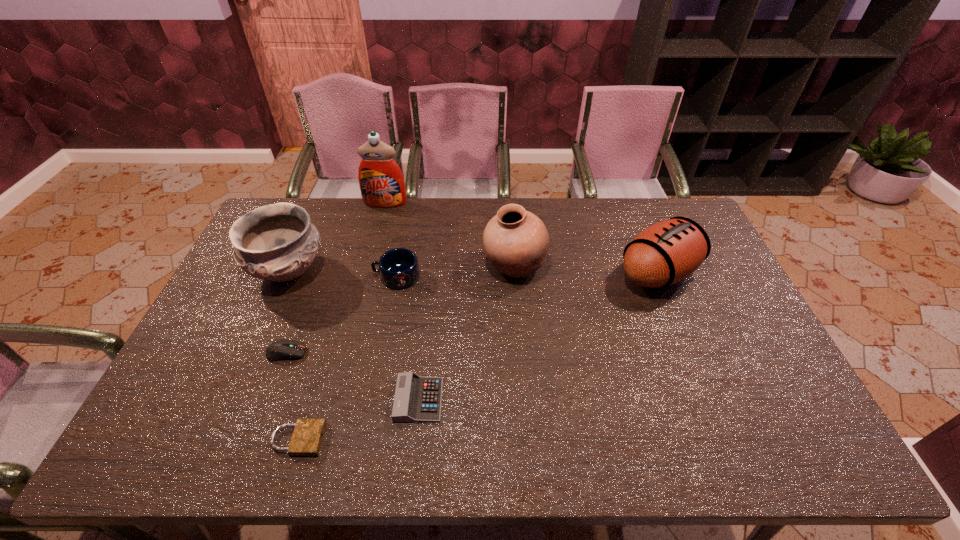
Find the location of a particular element. The image size is (960, 540). vacant space that satisfies the following two spatial constraints: 1. on the front surface of the farthest object; 2. on the left side of the football (American) is located at coordinates tap(368, 273).

Image resolution: width=960 pixels, height=540 pixels. I want to click on vacant space that satisfies the following two spatial constraints: 1. on the front surface of the seventh farthest object; 2. on the right side of the tallest object, so click(335, 400).

Find the location of a particular element. This screenshot has width=960, height=540. vacant position in the image that satisfies the following two spatial constraints: 1. with the handle on the side of the calculator; 2. on the right side of the mug is located at coordinates [373, 400].